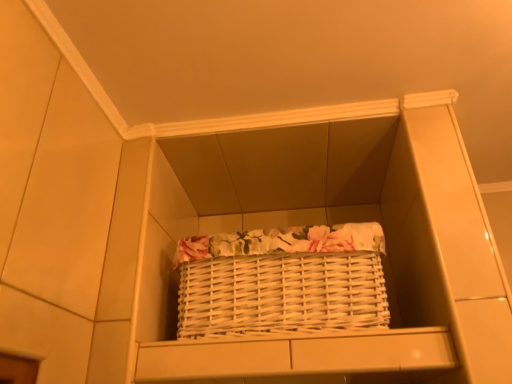
The image size is (512, 384). I want to click on white wicker picnic basket at center, so click(x=281, y=294).

Measure the distance between point (x=226, y=285) and camera.

Point (x=226, y=285) is 32.91 inches from camera.

What is the approximate height of white wicker picnic basket at center?

22.42 centimeters.

Measure the distance between white wicker picnic basket at center and camera.

The distance of white wicker picnic basket at center from camera is 75.95 centimeters.

Describe the element at coordinates (281, 294) in the screenshot. This screenshot has height=384, width=512. I see `white wicker picnic basket at center` at that location.

Locate an element on the screen. This screenshot has width=512, height=384. white wicker picnic basket at center is located at coordinates (281, 294).